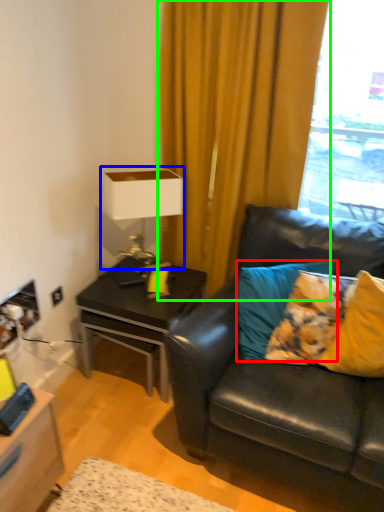
Question: Based on their relative distances, which object is farther from pillow (highlighted by a red box)? Choose from table lamp (highlighted by a blue box) and curtain (highlighted by a green box).

Choices:
 (A) table lamp
 (B) curtain

Answer: (B)